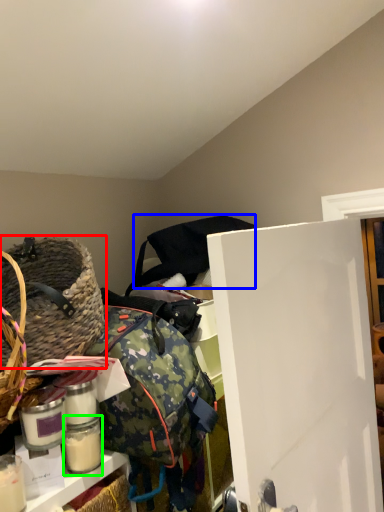
Question: Which object is the closest to the picnic basket (highlighted by a red box)? Choose among these: bag (highlighted by a blue box) or glass jar (highlighted by a green box).

Choices:
 (A) bag
 (B) glass jar

Answer: (B)